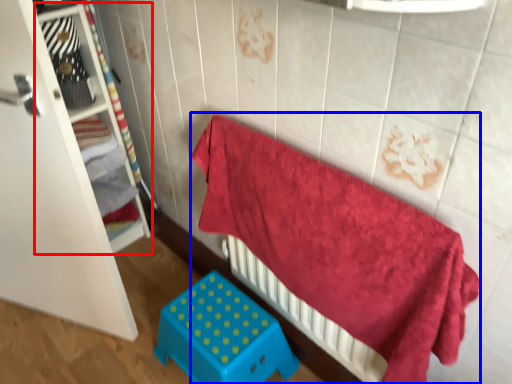
Question: Which point is further to the camera, shelf (highlighted by a red box) or bed (highlighted by a blue box)?

Choices:
 (A) shelf
 (B) bed

Answer: (A)